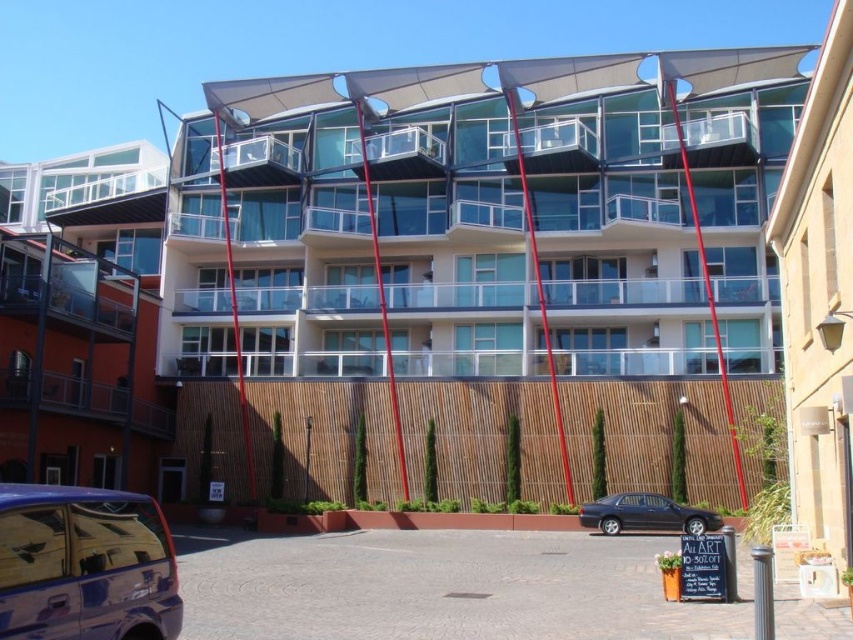
From the picture: Is matte glass building at center further to the viewer compared to brown wooden building at upper center?

Yes, matte glass building at center is further from the viewer.

Measure the distance between point (657, 64) and camera.

Point (657, 64) is 64.44 meters away from camera.

Locate an element on the screen. matte glass building at center is located at coordinates (474, 220).

Is matte glass building at center closer to the viewer compared to glossy black sedan at lower center?

No, it is not.

Does matte glass building at center have a larger size compared to glossy black sedan at lower center?

Yes.

Is point (447, 211) more distant than point (670, 499)?

Yes, it is.

The image size is (853, 640). In order to click on matte glass building at center in this screenshot , I will do `click(474, 220)`.

Is matte glass building at center to the left of shiny metallic van at lower left from the viewer's perspective?

Incorrect, matte glass building at center is not on the left side of shiny metallic van at lower left.

Is matte glass building at center thinner than shiny metallic van at lower left?

No.

Between point (508, 234) and point (90, 605), which one is positioned in front?

Positioned in front is point (90, 605).

This screenshot has height=640, width=853. I want to click on matte glass building at center, so click(x=474, y=220).